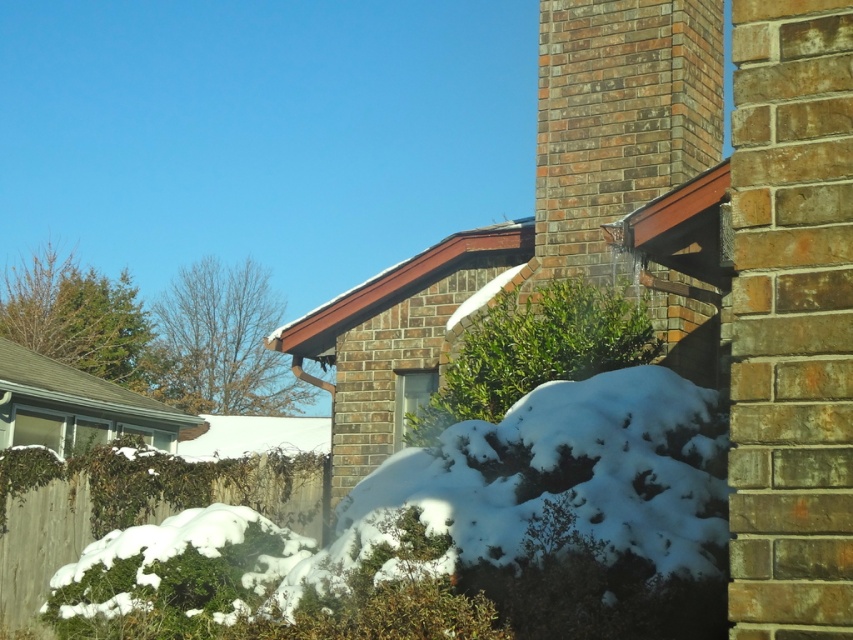
You are standing in front of the brick house and notice two points marked in the scene. The first point is at coordinate point(393,561) and the second is at point(584,116). Which point is nearer to you?

Point(393,561) is closer to the camera than point(584,116), so the first point is nearer to you.